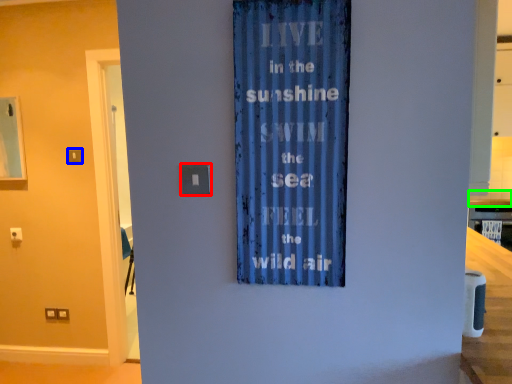
Question: Based on their relative distances, which object is farther from light switch (highlighted by a red box)? Choose from light switch (highlighted by a blue box) and counter top (highlighted by a green box).

Choices:
 (A) light switch
 (B) counter top

Answer: (B)